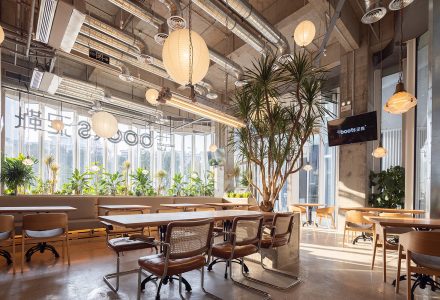
What are the coordinates of `overhead ductwork` in the screenshot? It's located at (260, 19), (243, 28), (226, 59), (205, 81), (197, 91), (105, 24), (79, 82), (74, 87), (74, 93).